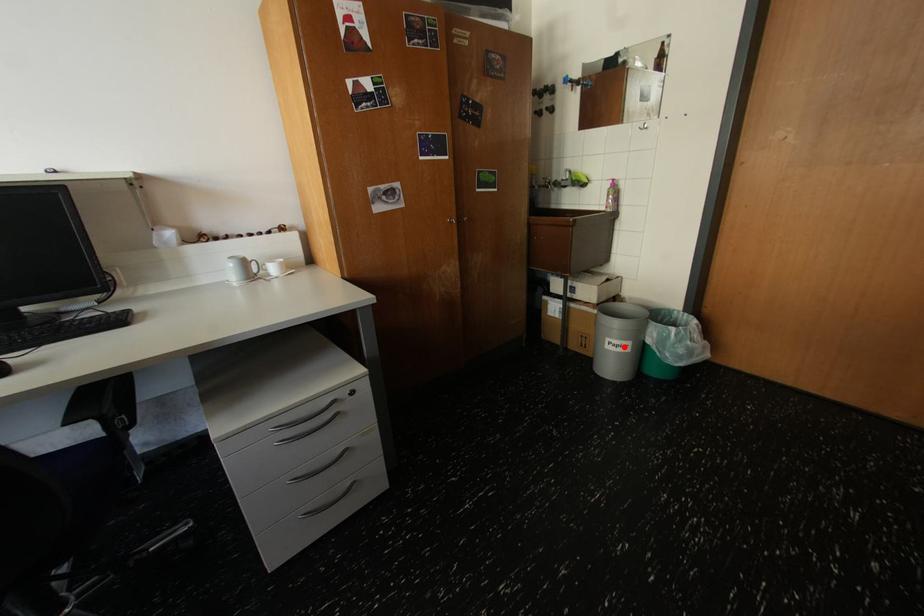
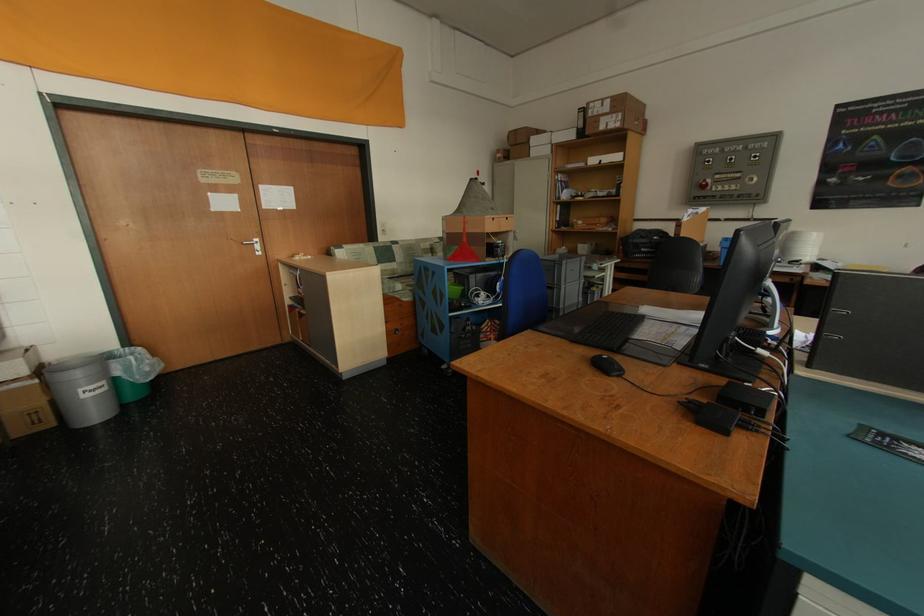
Where in the second image is the point corresponding to the highlighted location from the first image?

(101, 392)